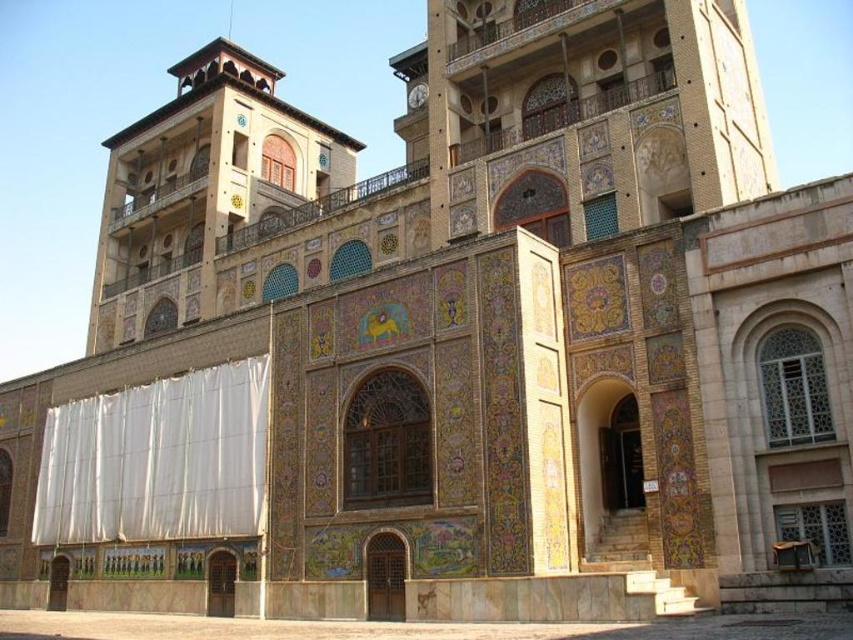
Is white fabric curtain at lower left further to the viewer compared to metallic clock at upper center?

No, white fabric curtain at lower left is closer to the viewer.

In the scene shown: Is white fabric curtain at lower left above metallic clock at upper center?

No, white fabric curtain at lower left is not above metallic clock at upper center.

Between point (144, 520) and point (424, 88), which one is positioned in front?

Point (144, 520) is more forward.

Locate an element on the screen. Image resolution: width=853 pixels, height=640 pixels. white fabric curtain at lower left is located at coordinates (157, 460).

Which is more to the left, yellowish stone tower at upper left or metallic clock at upper center?

Positioned to the left is yellowish stone tower at upper left.

Can you confirm if yellowish stone tower at upper left is positioned to the right of metallic clock at upper center?

Incorrect, yellowish stone tower at upper left is not on the right side of metallic clock at upper center.

Image resolution: width=853 pixels, height=640 pixels. What are the coordinates of `yellowish stone tower at upper left` in the screenshot? It's located at (202, 189).

Can you confirm if yellowish stone tower at upper left is positioned below white fabric curtain at lower left?

No, yellowish stone tower at upper left is not below white fabric curtain at lower left.

Consider the image. Does yellowish stone tower at upper left have a lesser height compared to white fabric curtain at lower left?

No.

Where is `yellowish stone tower at upper left`? The width and height of the screenshot is (853, 640). yellowish stone tower at upper left is located at coordinates (202, 189).

I want to click on yellowish stone tower at upper left, so click(202, 189).